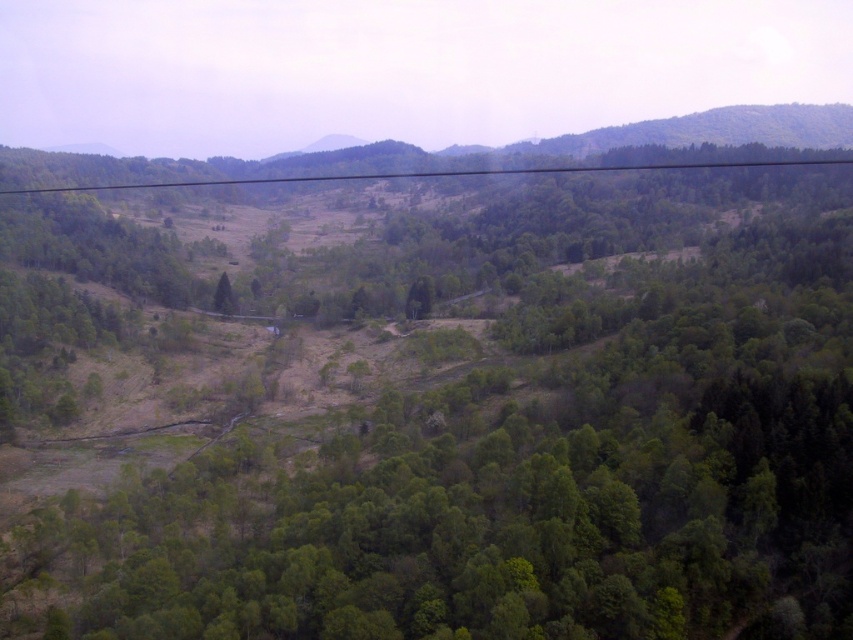
Between black wire at upper center and green leafy tree at center, which one is positioned lower?

Positioned lower is green leafy tree at center.

Is the position of black wire at upper center more distant than that of green leafy tree at center?

Yes, black wire at upper center is further from the viewer.

The image size is (853, 640). What do you see at coordinates (437, 173) in the screenshot?
I see `black wire at upper center` at bounding box center [437, 173].

The image size is (853, 640). Identify the location of black wire at upper center. (437, 173).